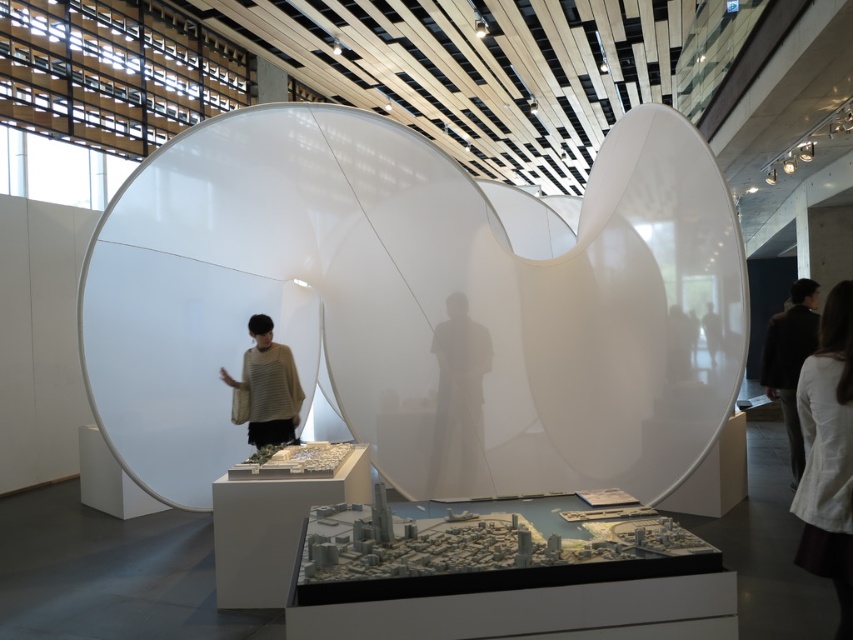
Question: Estimate the real-world distances between objects in this image. Which object is farther from the white fabric at center?

Choices:
 (A) dark brown suit at right
 (B) striped sweater at center

Answer: (B)

Question: Which object is the farthest from the white fabric at center?

Choices:
 (A) striped sweater at center
 (B) dark brown suit at right

Answer: (A)

Question: Considering the real-world distances, which object is closest to the white fabric at center?

Choices:
 (A) dark brown suit at right
 (B) striped sweater at center

Answer: (A)

Question: Does white fabric at center have a lesser width compared to dark brown suit at right?

Choices:
 (A) no
 (B) yes

Answer: (B)

Question: Is white fabric at center to the right of striped sweater at center from the viewer's perspective?

Choices:
 (A) yes
 (B) no

Answer: (A)

Question: Can you confirm if striped sweater at center is thinner than dark brown suit at right?

Choices:
 (A) no
 (B) yes

Answer: (A)